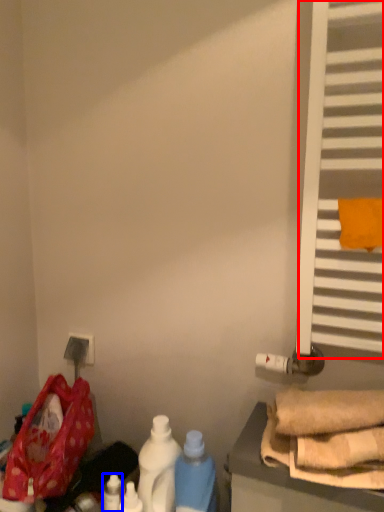
Question: Which object appears closest to the camera in this image, window (highlighted by a red box) or bottle (highlighted by a blue box)?

Choices:
 (A) window
 (B) bottle

Answer: (A)